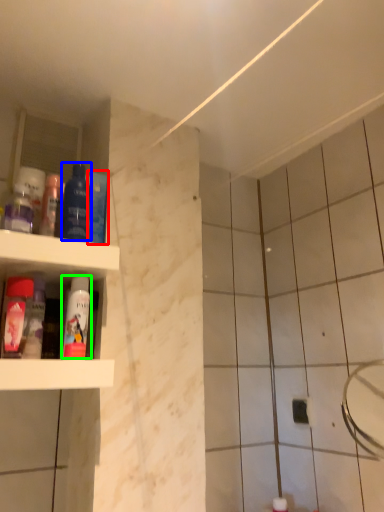
Question: Which object is positioned closest to mouthwash (highlighted by a red box)? Select from mouthwash (highlighted by a blue box) and mouthwash (highlighted by a green box).

Choices:
 (A) mouthwash
 (B) mouthwash

Answer: (A)